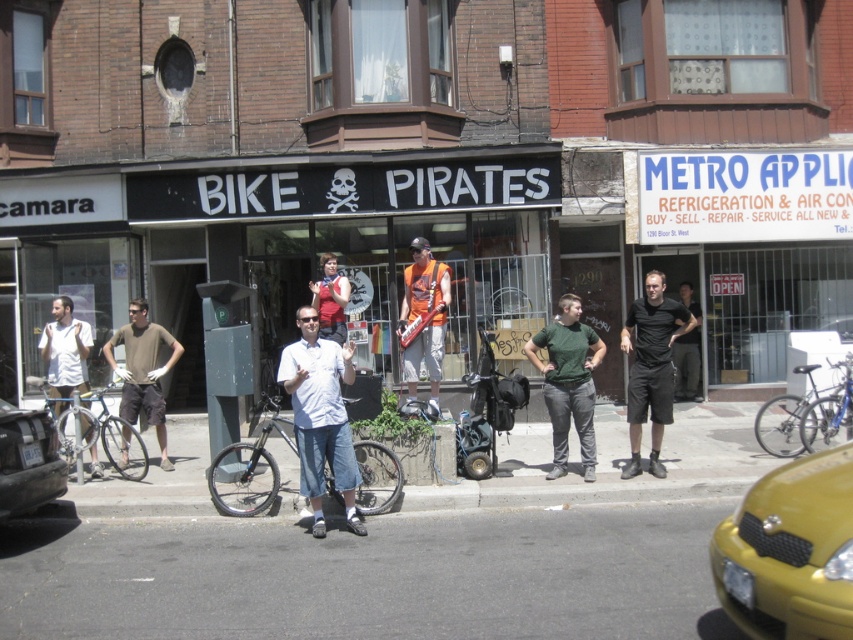
Question: In this image, where is brown cotton shirt at left located relative to orange fabric guitar at center?

Choices:
 (A) above
 (B) below

Answer: (B)

Question: Observing the image, what is the correct spatial positioning of black matte car at lower left in reference to silver metallic bicycle at left?

Choices:
 (A) above
 (B) below

Answer: (A)

Question: Can you confirm if silver metallic bicycle at left is positioned to the right of matte red shirt at center?

Choices:
 (A) no
 (B) yes

Answer: (A)

Question: Which object is closer to the camera taking this photo?

Choices:
 (A) white matte shirt at left
 (B) matte red shirt at center
 (C) green matte shirt at center
 (D) black cotton shirt at center

Answer: (C)

Question: Which object is positioned farthest from the yellow matte taxi at lower right?

Choices:
 (A) white matte shirt at left
 (B) black matte shorts at center
 (C) blue metallic bicycle at center

Answer: (A)

Question: Which of these objects is positioned farthest from the black matte shorts at center?

Choices:
 (A) brown cotton shirt at left
 (B) white matte shirt at left
 (C) white matte shirt at center
 (D) shiny metallic bicycle at center

Answer: (B)